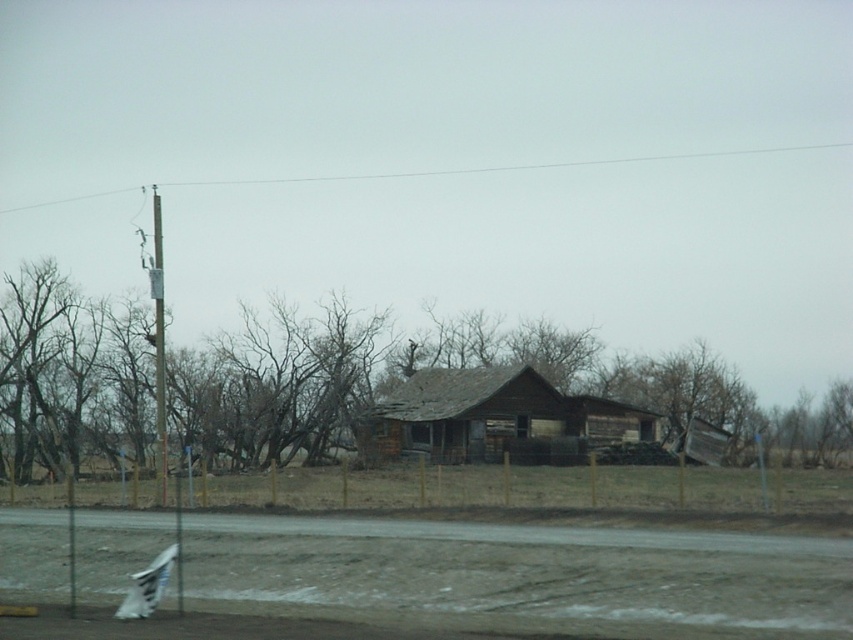
You are standing in front of the old wooden house and notice the brown wooden fence at center and the smooth gray pole at left. Which object is closer to you?

The brown wooden fence at center is closer to you because it is further to the viewer than the smooth gray pole at left.

You are standing at the point labeled as point (x=444, y=369) in the image. What is the nearest object to you in the scene?

The nearest object to you is the brown wooden fence at center, as the point (x=444, y=369) is located on it.

You are a surveyor measuring the structures in the image. Which object is shorter between the weathered wood hut at center and the smooth gray pole at left?

The weathered wood hut at center is shorter than the smooth gray pole at left according to the description.